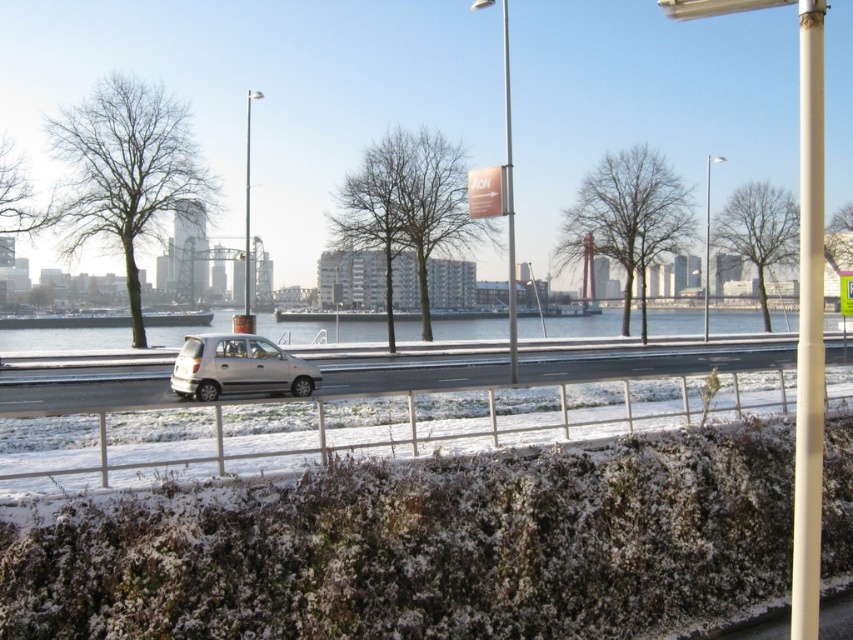
Question: Which object is farther from the camera taking this photo?

Choices:
 (A) metallic pole at center
 (B) silver metallic car at center

Answer: (A)

Question: Does white smooth pole at right have a greater width compared to silver metallic car at center?

Choices:
 (A) yes
 (B) no

Answer: (A)

Question: Does silver metallic car at center have a greater width compared to metallic pole at center?

Choices:
 (A) no
 (B) yes

Answer: (A)

Question: Which object is closer to the camera taking this photo?

Choices:
 (A) silver metallic car at center
 (B) metallic pole at center

Answer: (A)

Question: From the image, what is the correct spatial relationship of white smooth pole at right in relation to silver metallic car at center?

Choices:
 (A) above
 (B) below

Answer: (A)

Question: Estimate the real-world distances between objects in this image. Which object is farther from the white matte car at center?

Choices:
 (A) silver metallic car at center
 (B) white smooth pole at right

Answer: (A)